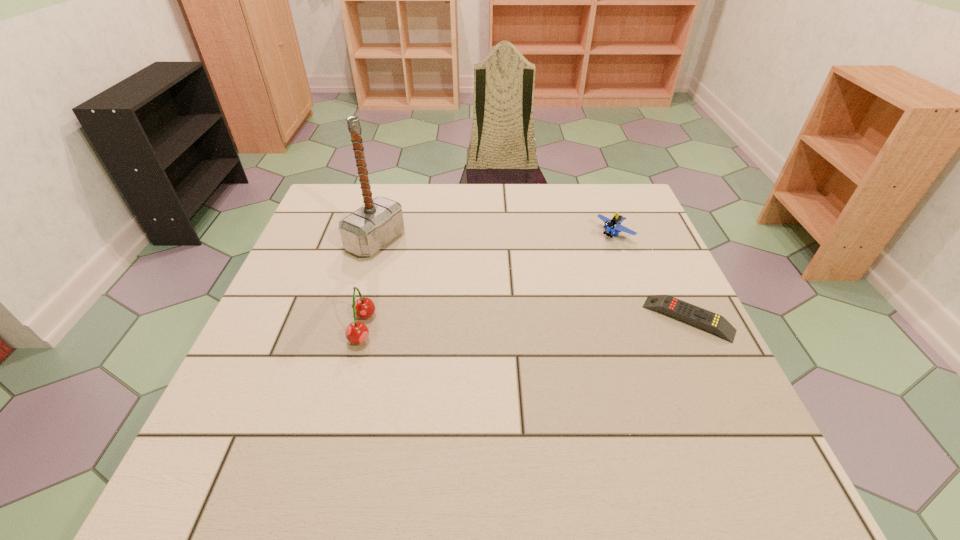
Locate an element on the screen. free space between the cherry and the tallest object is located at coordinates (369, 285).

Where is `free spot between the third shortest object and the Lego`? The width and height of the screenshot is (960, 540). free spot between the third shortest object and the Lego is located at coordinates (488, 281).

Identify the location of vacant area between the remote control and the tallest object. (532, 280).

You are a GUI agent. You are given a task and a screenshot of the screen. Output one action in this format:
    pyautogui.click(x=<x>, y=<y>)
    Task: Click on the vacant space that is in between the Lego and the tallest object
    Image resolution: width=960 pixels, height=540 pixels.
    Given the screenshot: What is the action you would take?
    pyautogui.click(x=495, y=238)

Identify which object is the second nearest to the Lego. Please provide its 2D coordinates. Your answer should be formatted as a tuple, i.e. [(x, y)], where the tuple contains the x and y coordinates of a point satisfying the conditions above.

[(365, 231)]

Choose which object is the nearest neighbor to the remote control. Please provide its 2D coordinates. Your answer should be formatted as a tuple, i.e. [(x, y)], where the tuple contains the x and y coordinates of a point satisfying the conditions above.

[(612, 225)]

This screenshot has width=960, height=540. Identify the location of vacant space that satisfies the following two spatial constraints: 1. on the front side of the remote control; 2. on the left side of the hammer. (353, 319).

The image size is (960, 540). What are the coordinates of `blank space that satisfies the following two spatial constraints: 1. on the front side of the cherry; 2. with stems pointing upwards on the hammer` in the screenshot? It's located at (351, 328).